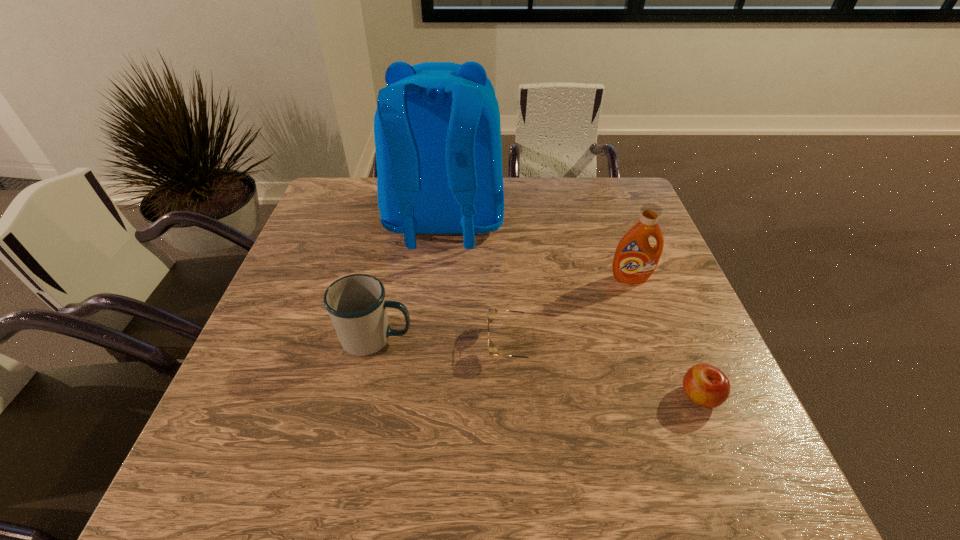
Where is `the tallest object`? the tallest object is located at coordinates (437, 130).

Locate an element on the screen. Image resolution: width=960 pixels, height=540 pixels. the farthest object is located at coordinates (437, 130).

Locate an element on the screen. The image size is (960, 540). the fourth nearest object is located at coordinates (635, 259).

Identify the location of the second tallest object. (635, 259).

At what (x,y) coordinates should I click in order to perform the action: click on mug. Please return your answer as a coordinate pair (x, y). The height and width of the screenshot is (540, 960). Looking at the image, I should click on (356, 304).

Find the location of a particular element. The height and width of the screenshot is (540, 960). the second shortest object is located at coordinates (707, 386).

What are the coordinates of `the nearest object` in the screenshot? It's located at (707, 386).

Where is `sunglasses`? Image resolution: width=960 pixels, height=540 pixels. sunglasses is located at coordinates point(492,350).

Identify the location of free location located 0.090m on the back of the tallest object. Image resolution: width=960 pixels, height=540 pixels. [x=438, y=291].

Locate an element on the screen. The image size is (960, 540). vacant space located 0.370m on the front-facing side of the fourth nearest object is located at coordinates (682, 417).